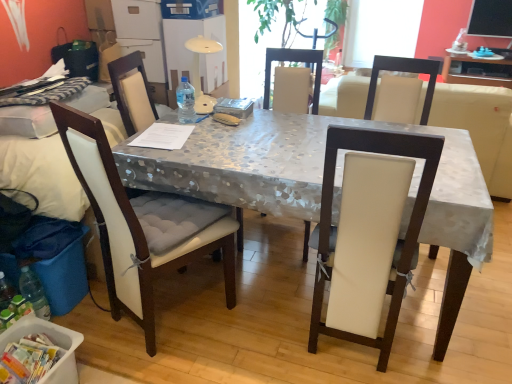
Question: Considering the relative sizes of metallic silver table at center and white plastic container at lower left in the image provided, is metallic silver table at center wider than white plastic container at lower left?

Choices:
 (A) no
 (B) yes

Answer: (B)

Question: Is metallic silver table at center thinner than white plastic container at lower left?

Choices:
 (A) no
 (B) yes

Answer: (A)

Question: From the image's perspective, does metallic silver table at center appear lower than white plastic container at lower left?

Choices:
 (A) no
 (B) yes

Answer: (A)

Question: Is metallic silver table at center smaller than white plastic container at lower left?

Choices:
 (A) no
 (B) yes

Answer: (A)

Question: Can you confirm if metallic silver table at center is positioned to the left of white plastic container at lower left?

Choices:
 (A) no
 (B) yes

Answer: (A)

Question: Is white fabric chair at left, the 3th chair in the right-to-left sequence, taller or shorter than matte gray table at upper right?

Choices:
 (A) short
 (B) tall

Answer: (B)

Question: Is white fabric chair at left, the 1th chair viewed from the left, wider or thinner than matte gray table at upper right?

Choices:
 (A) wide
 (B) thin

Answer: (B)

Question: Considering the positions of white fabric chair at left, the 3th chair in the right-to-left sequence, and matte gray table at upper right in the image, is white fabric chair at left, the 3th chair in the right-to-left sequence, bigger or smaller than matte gray table at upper right?

Choices:
 (A) small
 (B) big

Answer: (B)

Question: Is point (100, 231) closer or farther from the camera than point (467, 64)?

Choices:
 (A) farther
 (B) closer

Answer: (B)

Question: Is white leather couch at center wider or thinner than white fabric chair at left, which ranks as the second chair in left-to-right order?

Choices:
 (A) thin
 (B) wide

Answer: (B)

Question: Considering the positions of white leather couch at center and white fabric chair at left, the 2th chair in the right-to-left sequence, in the image, is white leather couch at center taller or shorter than white fabric chair at left, the 2th chair in the right-to-left sequence,?

Choices:
 (A) short
 (B) tall

Answer: (A)

Question: Is point (474, 94) closer or farther from the camera than point (130, 84)?

Choices:
 (A) farther
 (B) closer

Answer: (A)

Question: Is white leather couch at center in front of or behind white fabric chair at left, which ranks as the second chair in left-to-right order, in the image?

Choices:
 (A) behind
 (B) front

Answer: (A)

Question: Considering their positions, is matte gray table at upper right located in front of or behind metallic silver table at center?

Choices:
 (A) behind
 (B) front

Answer: (A)

Question: In terms of size, does matte gray table at upper right appear bigger or smaller than metallic silver table at center?

Choices:
 (A) small
 (B) big

Answer: (A)